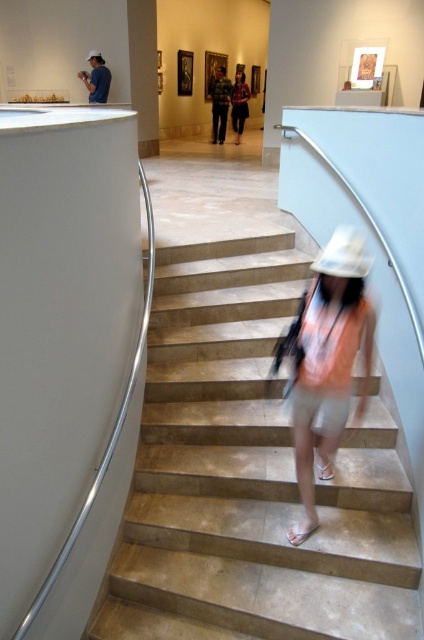
Question: Where is beige marble stairs at center located in relation to green plaid shirt at center in the image?

Choices:
 (A) below
 (B) above

Answer: (A)

Question: Which point is closer to the camera?

Choices:
 (A) (215, 129)
 (B) (91, 88)
 (C) (239, 131)

Answer: (B)

Question: Can you confirm if denim jacket at upper left is positioned to the right of dark green shirt at center?

Choices:
 (A) no
 (B) yes

Answer: (A)

Question: Which point appears farthest from the camera in this image?

Choices:
 (A) (239, 81)
 (B) (220, 125)
 (C) (89, 99)

Answer: (A)

Question: Among these objects, which one is farthest from the camera?

Choices:
 (A) light pink fabric hat at center
 (B) dark green shirt at center
 (C) beige marble stairs at center
 (D) green plaid shirt at center

Answer: (B)

Question: Is beige marble stairs at center thinner than green plaid shirt at center?

Choices:
 (A) yes
 (B) no

Answer: (B)